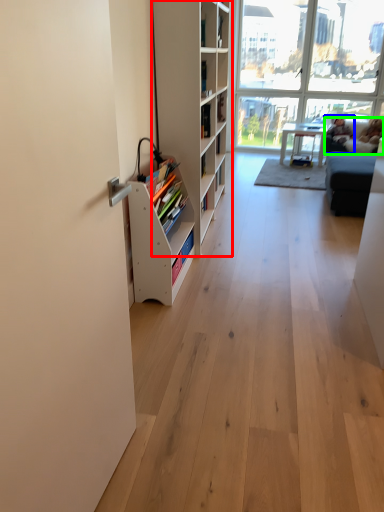
Question: Which is farther away from shelf (highlighted by a red box)? person (highlighted by a blue box) or couch (highlighted by a green box)?

Choices:
 (A) person
 (B) couch

Answer: (A)